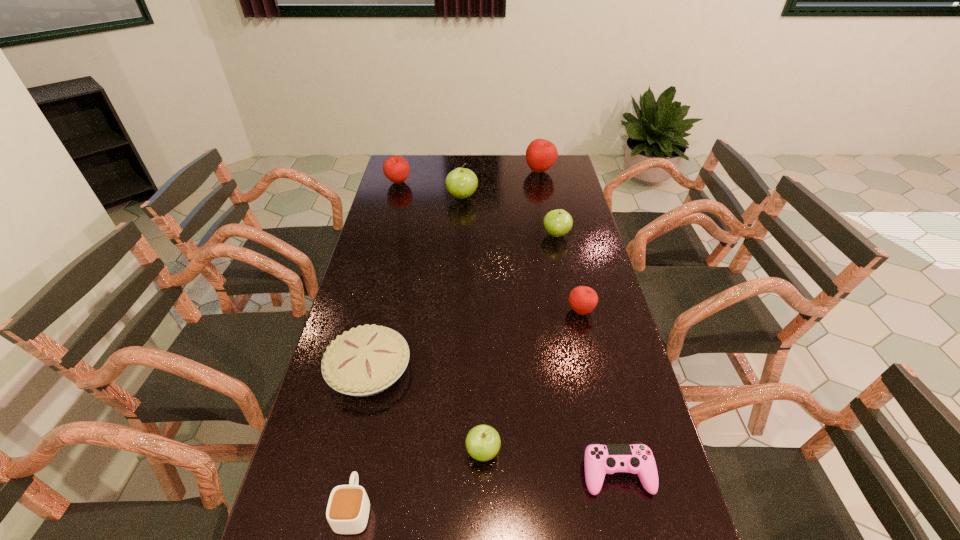
Image resolution: width=960 pixels, height=540 pixels. Find the location of `the biggest green apple`. the biggest green apple is located at coordinates (461, 183).

The width and height of the screenshot is (960, 540). Identify the location of the biggest red apple. (541, 154).

Identify the location of the leftmost red apple. (396, 168).

Identify the location of the leftmost apple. This screenshot has width=960, height=540. (396, 168).

Where is `the second smallest green apple`? This screenshot has width=960, height=540. the second smallest green apple is located at coordinates 557,223.

Where is `the rightmost green apple`? the rightmost green apple is located at coordinates (557, 223).

This screenshot has height=540, width=960. I want to click on the second nearest apple, so click(x=582, y=299).

Locate an element on the screen. the smallest red apple is located at coordinates (582, 299).

Identify the location of the nearest apple. (483, 442).

This screenshot has width=960, height=540. I want to click on the nearest green apple, so click(x=483, y=442).